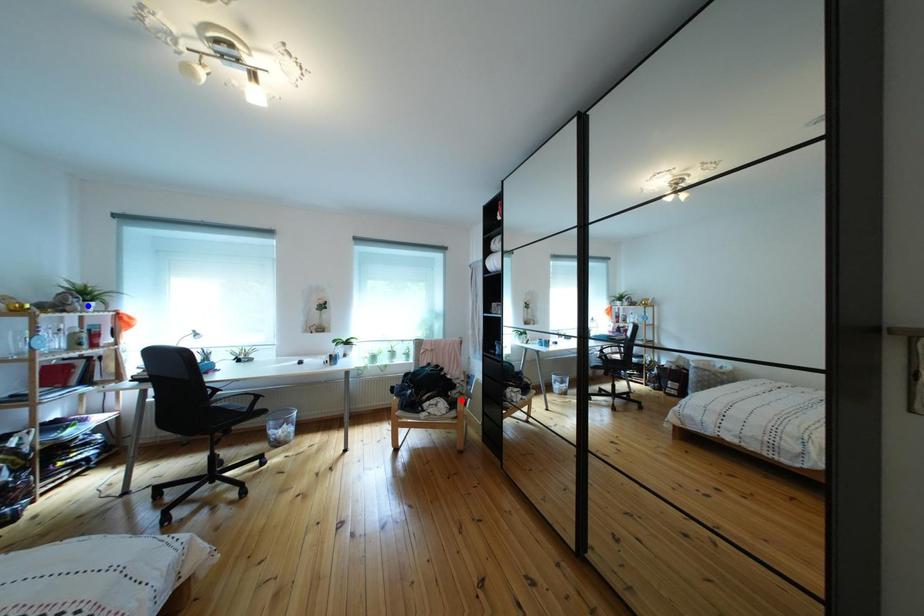
Question: Two points are marked on the image. Which point is closer to the camera?

Choices:
 (A) Blue point is closer.
 (B) Red point is closer.

Answer: (A)